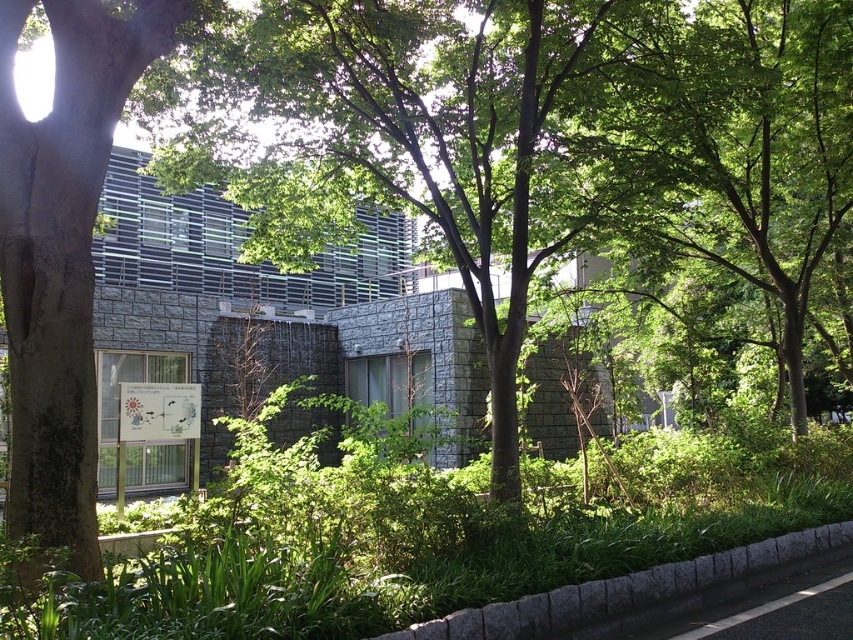
Question: Among these points, which one is nearest to the camera?

Choices:
 (A) (28, 253)
 (B) (831, 534)

Answer: (A)

Question: Based on their relative distances, which object is farther from the green leafy tree at left?

Choices:
 (A) green leafy tree at center
 (B) gray concrete curb at lower center

Answer: (A)

Question: Is green leafy tree at center to the right of green leafy tree at left from the viewer's perspective?

Choices:
 (A) yes
 (B) no

Answer: (A)

Question: Does green leafy tree at center have a lesser width compared to gray concrete curb at lower center?

Choices:
 (A) yes
 (B) no

Answer: (A)

Question: Can you confirm if green leafy tree at center is bigger than green leafy tree at left?

Choices:
 (A) yes
 (B) no

Answer: (B)

Question: Among these objects, which one is nearest to the camera?

Choices:
 (A) green leafy tree at left
 (B) green leafy tree at center
 (C) gray concrete curb at lower center

Answer: (A)